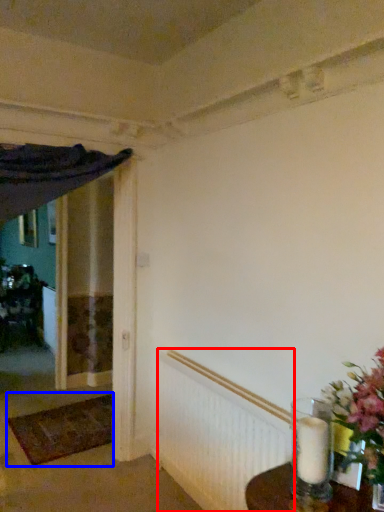
Question: Which point is further to the camera, radiator (highlighted by a red box) or doormat (highlighted by a blue box)?

Choices:
 (A) radiator
 (B) doormat

Answer: (B)